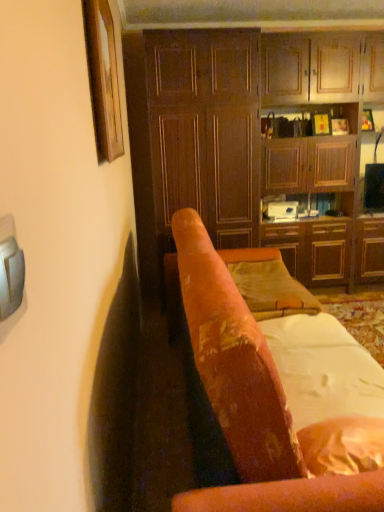
Question: Relative to wooden cabinet at right, is wooden picture frame at upper left in front or behind?

Choices:
 (A) front
 (B) behind

Answer: (A)

Question: Is point (96, 31) closer or farther from the camera than point (342, 184)?

Choices:
 (A) farther
 (B) closer

Answer: (B)

Question: Based on their relative distances, which object is nearer to the wooden cabinet at right?

Choices:
 (A) wooden cabinet at center
 (B) velvet-like orange chair at center
 (C) white soft fabric at center
 (D) velvet orange pillow at center
 (E) wooden picture frame at upper left

Answer: (A)

Question: Considering the real-world distances, which object is farthest from the velvet orange pillow at center?

Choices:
 (A) wooden cabinet at center
 (B) white soft fabric at center
 (C) wooden picture frame at upper left
 (D) wooden cabinet at right
 (E) velvet-like orange chair at center

Answer: (C)